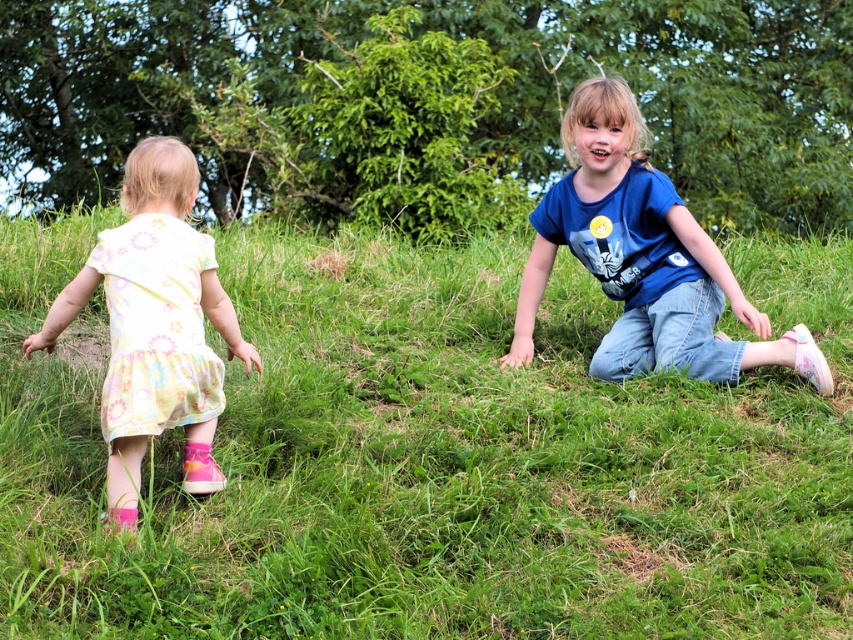
Question: Which point appears closest to the camera in this image?

Choices:
 (A) (315, 301)
 (B) (131, 342)
 (C) (529, 340)

Answer: (B)

Question: Does green grass at center come in front of blue cotton shirt at center?

Choices:
 (A) yes
 (B) no

Answer: (A)

Question: Which object appears farthest from the camera in this image?

Choices:
 (A) green grass at center
 (B) blue cotton shirt at center

Answer: (B)

Question: Does blue cotton shirt at center have a smaller size compared to pastel floral dress at left?

Choices:
 (A) no
 (B) yes

Answer: (A)

Question: Is green grass at center below pastel floral dress at left?

Choices:
 (A) no
 (B) yes

Answer: (B)

Question: Which of these objects is positioned farthest from the pastel floral dress at left?

Choices:
 (A) blue cotton shirt at center
 (B) green grass at center

Answer: (A)